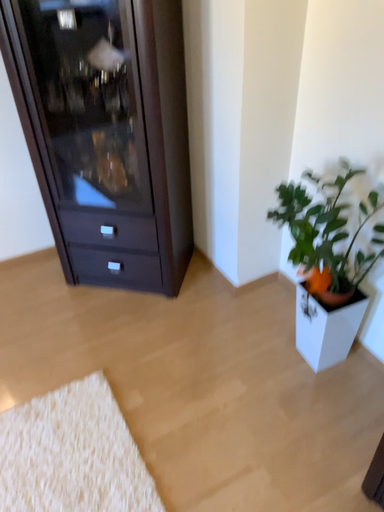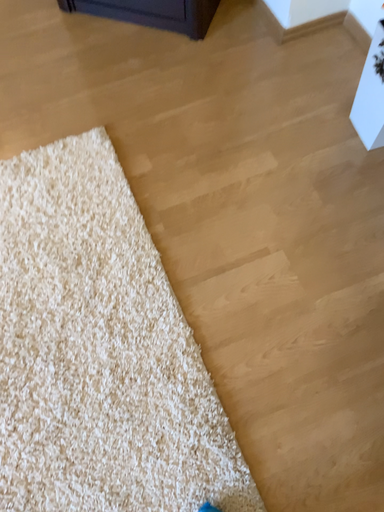
Question: Which way did the camera rotate in the video?

Choices:
 (A) rotated downward
 (B) rotated upward

Answer: (A)